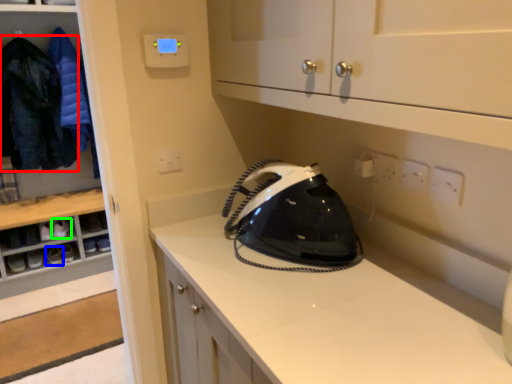
Question: Considering the real-world distances, which object is farthest from clothing (highlighted by a red box)? footwear (highlighted by a blue box) or footwear (highlighted by a green box)?

Choices:
 (A) footwear
 (B) footwear

Answer: (A)